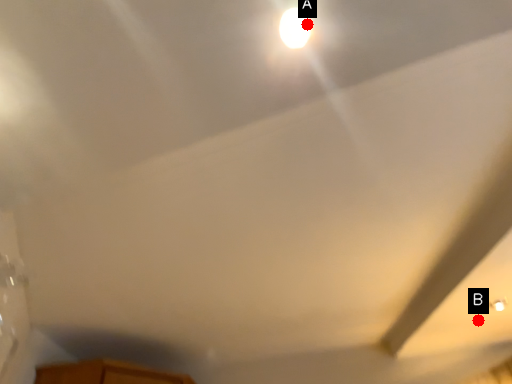
Question: Two points are circled on the image, labeled by A and B beside each circle. Which point is closer to the camera taking this photo?

Choices:
 (A) A is closer
 (B) B is closer

Answer: (A)